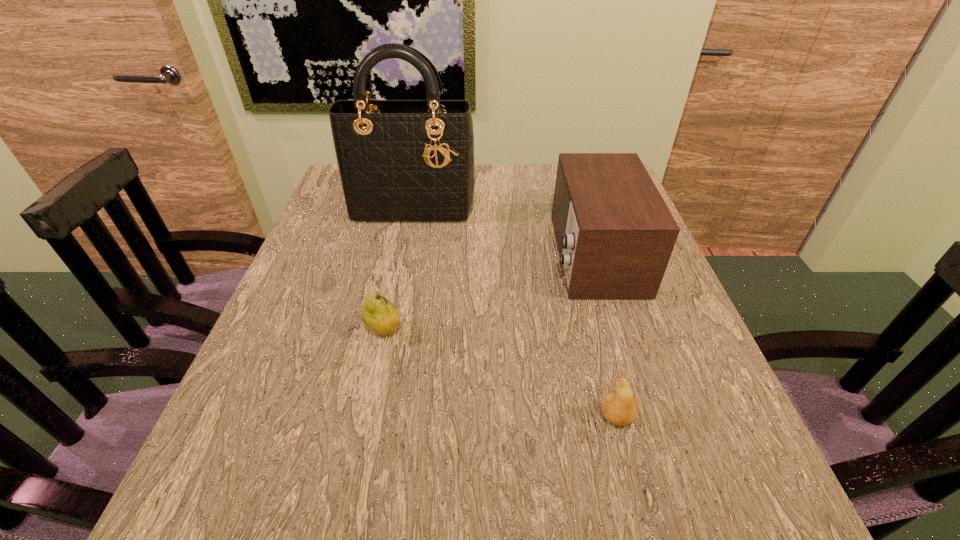
Identify the location of vacant area located 0.250m on the right of the second nearest object. coord(531,330).

The height and width of the screenshot is (540, 960). Find the location of `blank area located on the back of the nearest object`. blank area located on the back of the nearest object is located at coordinates [591, 319].

At what (x,y) coordinates should I click in order to perform the action: click on object that is at the far edge. Please return your answer as a coordinate pair (x, y). Looking at the image, I should click on (405, 162).

I want to click on object located at the left edge, so click(405, 162).

You are a GUI agent. You are given a task and a screenshot of the screen. Output one action in this format:
    pyautogui.click(x=<x>, y=<y>)
    Task: Click on the object that is at the right edge
    
    Given the screenshot: What is the action you would take?
    pyautogui.click(x=615, y=235)

Identify the location of object that is at the far left corner. [405, 162].

This screenshot has height=540, width=960. What are the coordinates of `vacant position at the far edge of the desktop` in the screenshot? It's located at (516, 197).

In the image, there is a desktop. Find the location of `vacant region at the right edge`. vacant region at the right edge is located at coordinates (633, 339).

Where is `free space at the near right corner of the desktop`? The width and height of the screenshot is (960, 540). free space at the near right corner of the desktop is located at coordinates click(x=744, y=510).

At what (x,y) coordinates should I click in order to perform the action: click on unoccupied position between the right pear and the tallest object. Please return your answer as a coordinate pair (x, y). The image size is (960, 540). Looking at the image, I should click on (515, 313).